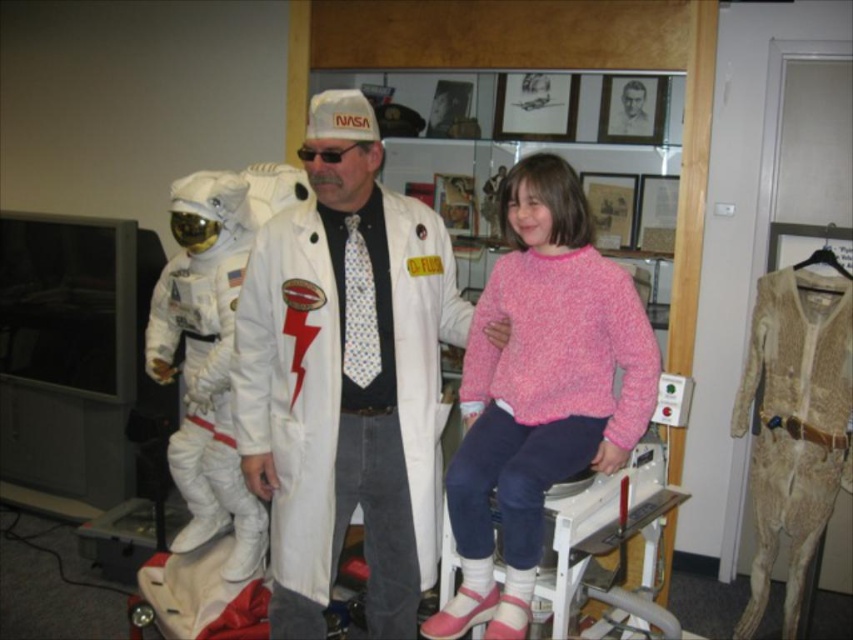
From the picture: Does white matte lab coat at center have a larger size compared to pink fuzzy sweater at center?

Yes.

Who is lower down, white matte lab coat at center or pink fuzzy sweater at center?

Positioned lower is white matte lab coat at center.

Describe the element at coordinates (346, 378) in the screenshot. I see `white matte lab coat at center` at that location.

The image size is (853, 640). What are the coordinates of `white matte lab coat at center` in the screenshot? It's located at (346, 378).

Does pink fuzzy sweater at center have a greater width compared to white fabric astronaut suit at left?

Indeed, pink fuzzy sweater at center has a greater width compared to white fabric astronaut suit at left.

Does pink fuzzy sweater at center have a smaller size compared to white fabric astronaut suit at left?

No, pink fuzzy sweater at center is not smaller than white fabric astronaut suit at left.

Describe the element at coordinates (538, 392) in the screenshot. Image resolution: width=853 pixels, height=640 pixels. I see `pink fuzzy sweater at center` at that location.

Where is `pink fuzzy sweater at center`? This screenshot has width=853, height=640. pink fuzzy sweater at center is located at coordinates (538, 392).

Find the location of a particular element. white matte lab coat at center is located at coordinates (346, 378).

Who is more forward, (378, 272) or (207, 497)?

Point (378, 272) is more forward.

The height and width of the screenshot is (640, 853). In order to click on white matte lab coat at center in this screenshot , I will do `click(346, 378)`.